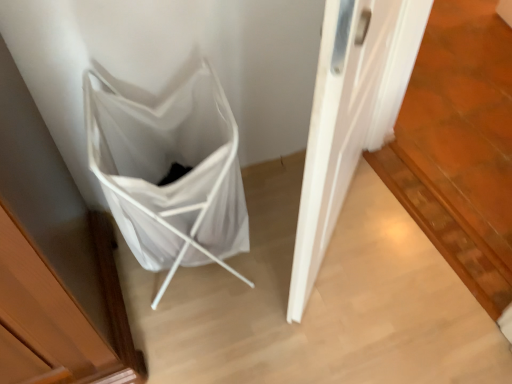
You are a GUI agent. You are given a task and a screenshot of the screen. Output one action in this format:
    pyautogui.click(x=<x>, y=<y>)
    Task: Click on the vacant space that is in between white matte door at center and white fabric folding chair at lower left
    The height and width of the screenshot is (384, 512).
    Given the screenshot: What is the action you would take?
    pyautogui.click(x=263, y=246)